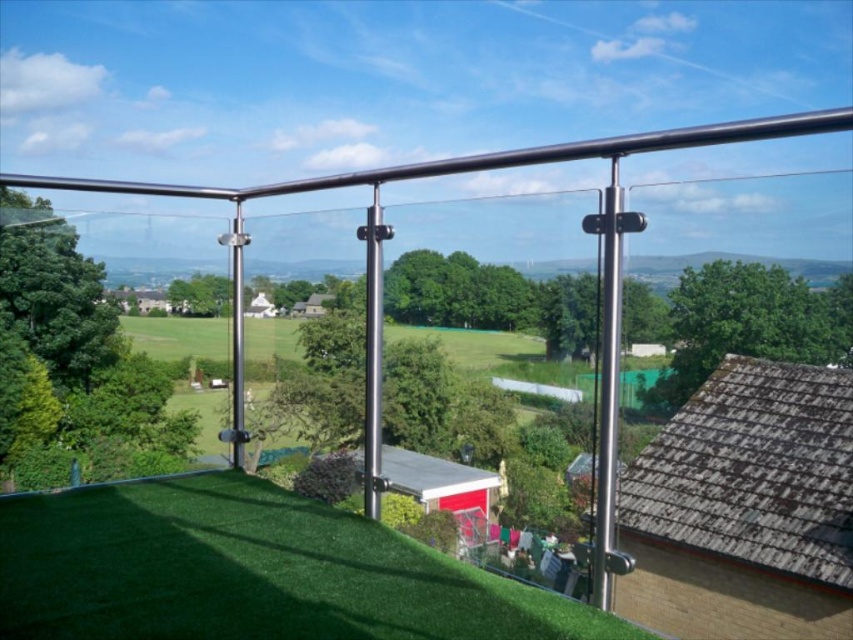
Question: Which object appears farthest from the camera in this image?

Choices:
 (A) polished stainless steel pole at center
 (B) polished metal pole at center
 (C) satin silver pole at center
 (D) green artificial turf at lower center

Answer: (C)

Question: Which of the following is the closest to the observer?

Choices:
 (A) (299, 614)
 (B) (234, 236)

Answer: (A)

Question: In this image, where is green artificial turf at lower center located relative to polished stainless steel pole at center?

Choices:
 (A) left
 (B) right

Answer: (A)

Question: Estimate the real-world distances between objects in this image. Which object is closer to the satin silver pole at center?

Choices:
 (A) green artificial turf at lower center
 (B) polished metal pole at center

Answer: (B)

Question: In this image, where is green artificial turf at lower center located relative to polished stainless steel pole at center?

Choices:
 (A) above
 (B) below

Answer: (B)

Question: Can you confirm if polished stainless steel pole at center is positioned below satin silver pole at center?

Choices:
 (A) yes
 (B) no

Answer: (A)